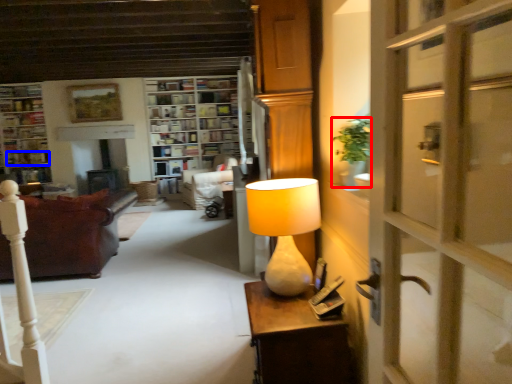
Question: Which object appears closest to the camera in this image, houseplant (highlighted by a red box) or book (highlighted by a blue box)?

Choices:
 (A) houseplant
 (B) book

Answer: (A)